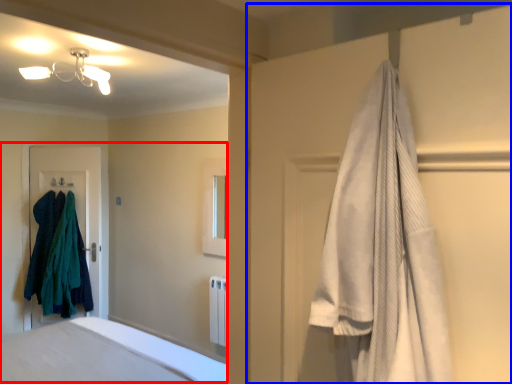
Question: Which of the following is the farthest to the observer, bed (highlighted by a red box) or closet (highlighted by a blue box)?

Choices:
 (A) bed
 (B) closet

Answer: (A)